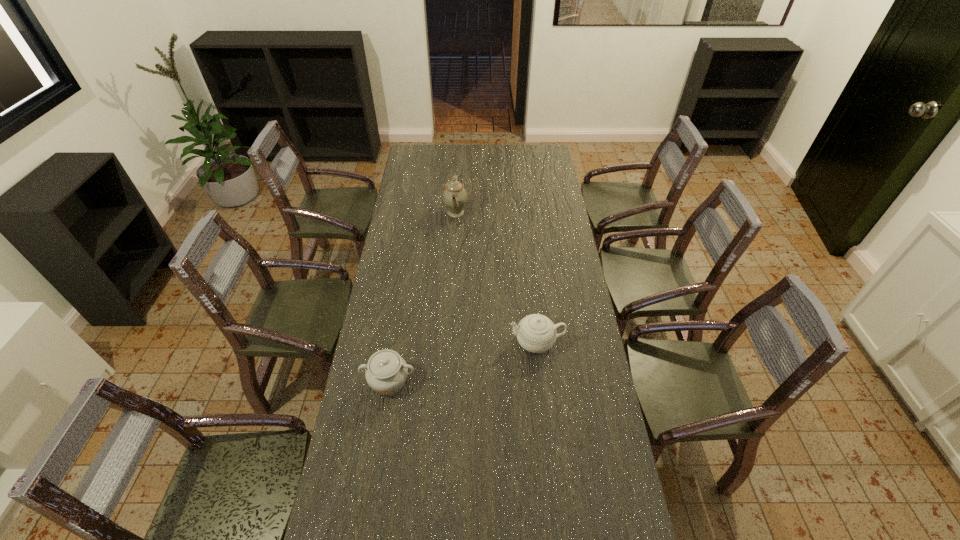
Image resolution: width=960 pixels, height=540 pixels. I want to click on the second chinaware from left to right, so click(454, 196).

Locate an element on the screen. This screenshot has width=960, height=540. the farthest object is located at coordinates (454, 196).

What are the coordinates of `the second nearest chinaware` in the screenshot? It's located at (536, 333).

The image size is (960, 540). In order to click on the rightmost chinaware in this screenshot , I will do `click(536, 333)`.

Identify the location of the nearest chinaware. This screenshot has width=960, height=540. (386, 373).

This screenshot has width=960, height=540. I want to click on the nearest object, so click(386, 373).

At what (x,y) coordinates should I click in order to perform the action: click on free space located on the spout of the farthest chinaware. Please return your answer as a coordinate pair (x, y). This screenshot has width=960, height=540. Looking at the image, I should click on (512, 213).

The height and width of the screenshot is (540, 960). Find the location of `free space located on the spout of the rightmost object`. free space located on the spout of the rightmost object is located at coordinates (454, 342).

Identify the location of vacant position located 0.070m on the spout of the rightmost object. (490, 342).

The height and width of the screenshot is (540, 960). What are the coordinates of `free space located on the spout of the rightmost object` in the screenshot? It's located at (421, 342).